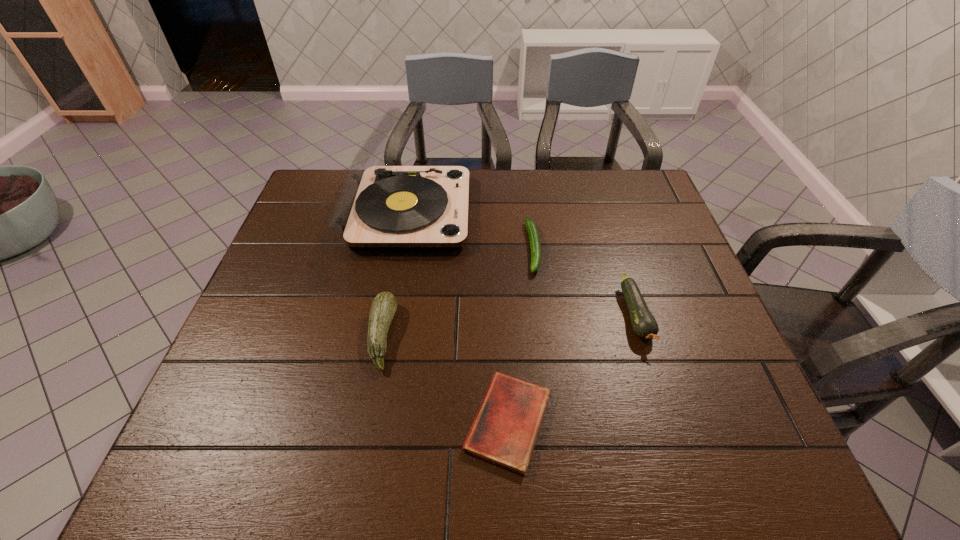
In order to click on record player in this screenshot , I will do `click(380, 207)`.

Locate an element on the screen. the leftmost zucchini is located at coordinates (383, 308).

Where is `the rightmost zucchini`? Image resolution: width=960 pixels, height=540 pixels. the rightmost zucchini is located at coordinates (644, 325).

The image size is (960, 540). In order to click on the farthest zucchini in this screenshot , I will do `click(535, 245)`.

Identify the location of the fourth tallest object. This screenshot has width=960, height=540. (535, 245).

You are a GUI agent. You are given a task and a screenshot of the screen. Output one action in this format:
    pyautogui.click(x=<x>, y=<y>)
    Task: Click on the diary
    
    Given the screenshot: What is the action you would take?
    pyautogui.click(x=504, y=432)

I want to click on the nearest object, so [504, 432].

This screenshot has width=960, height=540. In order to click on free space located 0.050m with the tonearm facing the front of the record player in this screenshot , I will do `click(485, 212)`.

The width and height of the screenshot is (960, 540). Find the location of `vacant region located 0.210m at the stem end of the leftmost zucchini`. vacant region located 0.210m at the stem end of the leftmost zucchini is located at coordinates (485, 336).

The image size is (960, 540). What are the coordinates of `free space located at the blossom end of the rightmost object` in the screenshot? It's located at (670, 423).